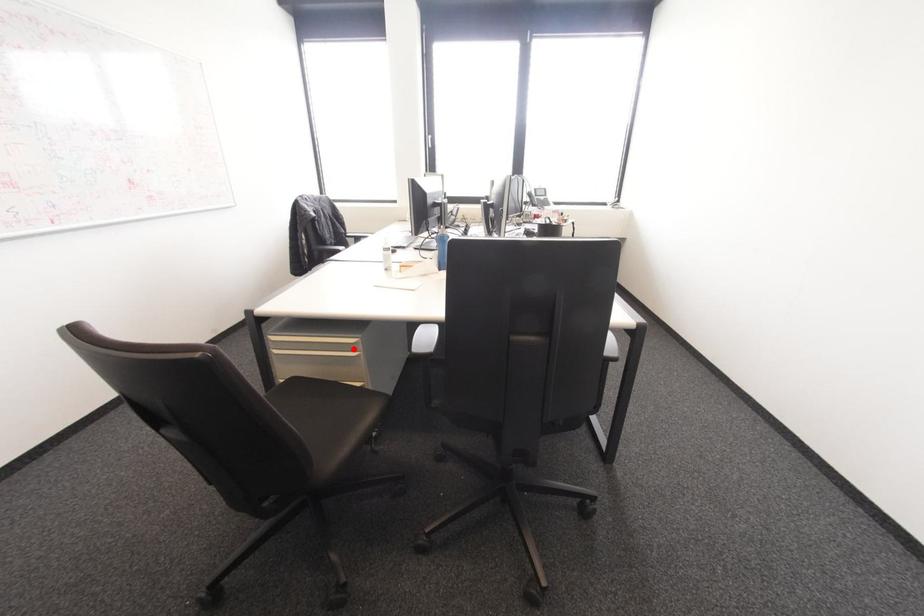
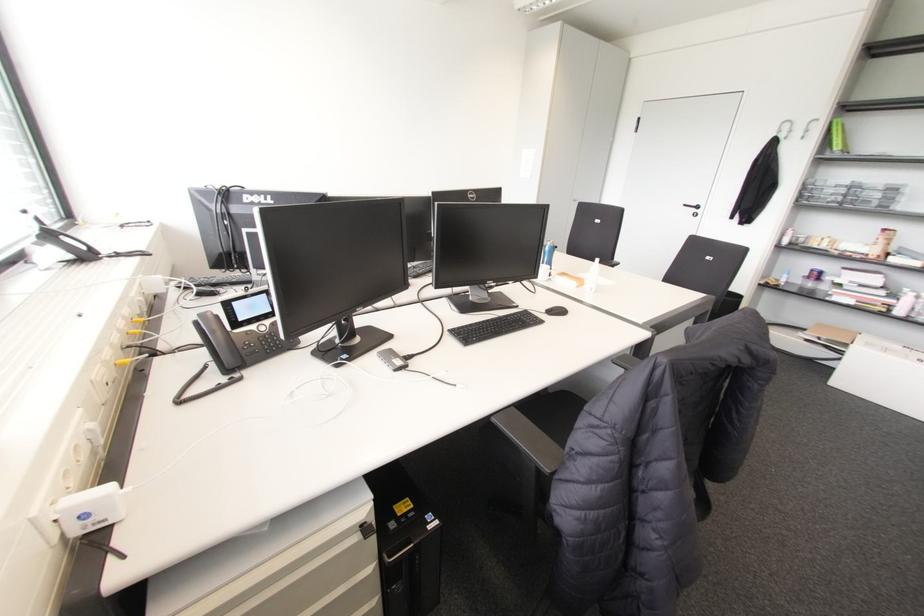
Question: I am providing you with two images of the same scene from different viewpoints. A red point is marked on the first image. Is the red point's position out of view in image 2?

Choices:
 (A) Yes
 (B) No

Answer: (A)